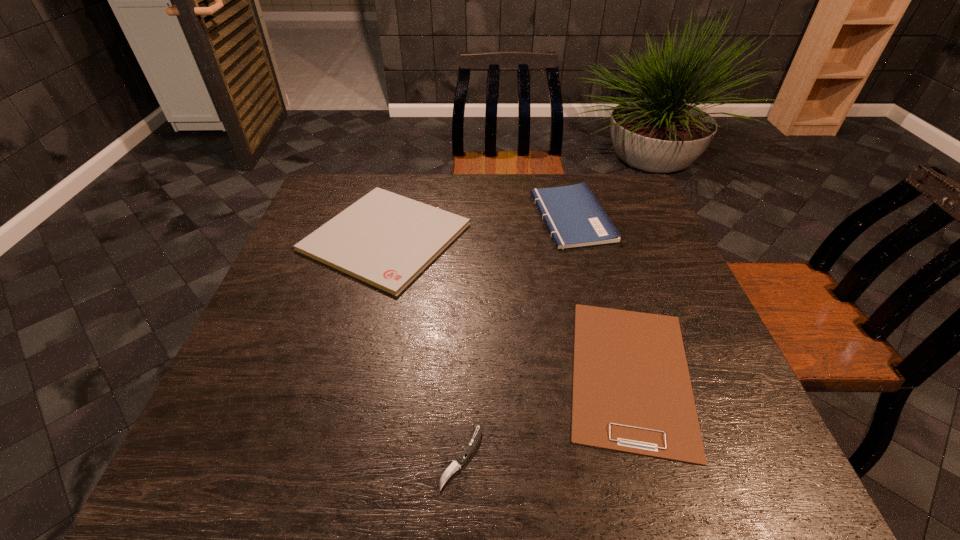
At what (x,y) coordinates should I click in order to perform the action: click on the tallest object. Please return your answer as a coordinate pair (x, y). Looking at the image, I should click on (574, 217).

Locate an element on the screen. the taller clipboard is located at coordinates (384, 239).

You are a GUI agent. You are given a task and a screenshot of the screen. Output one action in this format:
    pyautogui.click(x=<x>, y=<y>)
    Task: Click on the second tallest object
    This screenshot has width=960, height=540.
    Given the screenshot: What is the action you would take?
    pyautogui.click(x=384, y=239)

Locate an element on the screen. the right clipboard is located at coordinates click(x=632, y=393).

The image size is (960, 540). In order to click on the shorter clipboard in this screenshot , I will do `click(632, 393)`.

This screenshot has height=540, width=960. Identify the location of pocketknife. (471, 445).

At what (x,y) coordinates should I click in order to perform the action: click on blank space located 0.340m on the left of the tallest object. Please return your answer as a coordinate pair (x, y). This screenshot has height=540, width=960. Looking at the image, I should click on (419, 217).

Image resolution: width=960 pixels, height=540 pixels. Identify the location of blank space located on the front of the third shortest object. (337, 428).

At what (x,y) coordinates should I click in order to perform the action: click on vacant area situated on the left of the shorter clipboard. Please return your answer as a coordinate pair (x, y). Looking at the image, I should click on (433, 373).

The width and height of the screenshot is (960, 540). What are the coordinates of `blank space located 0.080m on the left of the pocketknife` in the screenshot? It's located at (396, 456).